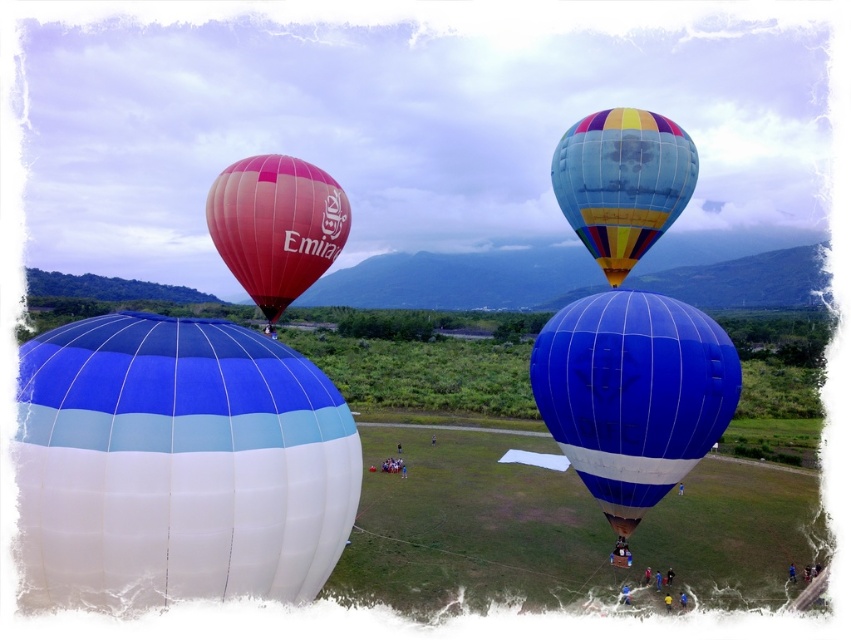
You are a photographer standing in the field and want to capture both the blue glossy hot air balloon at center and the rainbow striped hot air balloon at upper right in a single photo. Which balloon should you position closer to the front of your photo to include both?

You should position the blue glossy hot air balloon at center closer to the front of your photo because it is positioned under the rainbow striped hot air balloon at upper right, meaning it is closer to the photographer.

You are a photographer standing in the field and want to capture a photo of the blue glossy hot air balloon at center and the rainbow striped hot air balloon at upper right. If your camera can focus on objects within 10 meters, will both balloons be in focus?

The blue glossy hot air balloon at center is 10.67 meters from rainbow striped hot air balloon at upper right. Since the distance between them is more than 10 meters, the camera cannot focus on both balloons simultaneously.

You are standing in the field where the hot air balloons are preparing. You notice two points marked in the scene. The first point is at coordinates point(215, 586) and the second is at point(617, 372). Which of these points is closer to you?

The point at coordinates point(215, 586) is closer to you than the point at point(617, 372).